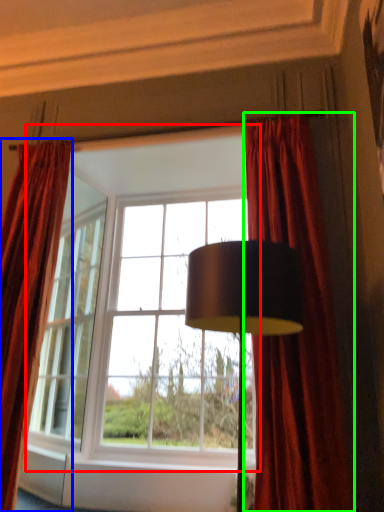
Question: Which object is the closest to the window (highlighted by a red box)? Choose among these: curtain (highlighted by a blue box) or curtain (highlighted by a green box).

Choices:
 (A) curtain
 (B) curtain

Answer: (A)